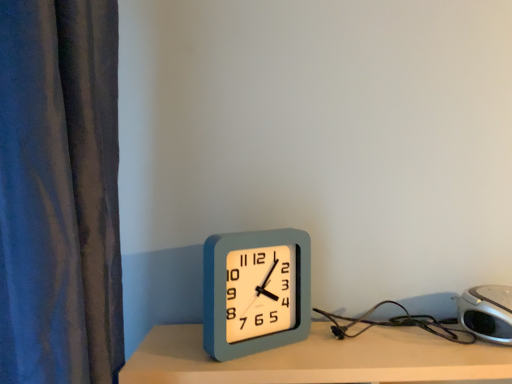
You are a GUI agent. You are given a task and a screenshot of the screen. Output one action in this format:
    pyautogui.click(x=<x>, y=<y>)
    Task: Click on the silver metallic alarm clock at lower right, arranged as the first alarm clock when viewed from the right
    The height and width of the screenshot is (384, 512).
    Given the screenshot: What is the action you would take?
    pyautogui.click(x=487, y=312)

What do you see at coordinates (487, 312) in the screenshot? I see `silver metallic alarm clock at lower right, arranged as the first alarm clock when viewed from the right` at bounding box center [487, 312].

How much space does silver metallic alarm clock at lower right, which is the second alarm clock in left-to-right order, occupy vertically?

silver metallic alarm clock at lower right, which is the second alarm clock in left-to-right order, is 3.45 inches in height.

Describe the element at coordinates (256, 291) in the screenshot. I see `light blue plastic clock at center, positioned as the second alarm clock in right-to-left order` at that location.

At what (x,y) coordinates should I click in order to perform the action: click on light blue plastic clock at center, positioned as the second alarm clock in right-to-left order. Please return your answer as a coordinate pair (x, y). The image size is (512, 384). Looking at the image, I should click on (256, 291).

This screenshot has height=384, width=512. Identify the location of silver metallic alarm clock at lower right, arranged as the first alarm clock when viewed from the right. (487, 312).

Considering the positions of objects silver metallic alarm clock at lower right, which is the second alarm clock in left-to-right order, and light blue plastic clock at center, positioned as the second alarm clock in right-to-left order, in the image provided, who is more to the left, silver metallic alarm clock at lower right, which is the second alarm clock in left-to-right order, or light blue plastic clock at center, positioned as the second alarm clock in right-to-left order,?

light blue plastic clock at center, positioned as the second alarm clock in right-to-left order.

Is silver metallic alarm clock at lower right, arranged as the first alarm clock when viewed from the right, positioned in front of light blue plastic clock at center, which ranks as the 1th alarm clock in left-to-right order?

Yes, it is in front of light blue plastic clock at center, which ranks as the 1th alarm clock in left-to-right order.

Considering the positions of point (476, 302) and point (250, 235), is point (476, 302) closer or farther from the camera than point (250, 235)?

Point (476, 302).

From the image's perspective, is silver metallic alarm clock at lower right, which is the second alarm clock in left-to-right order, beneath light blue plastic clock at center, which ranks as the 1th alarm clock in left-to-right order?

Correct, silver metallic alarm clock at lower right, which is the second alarm clock in left-to-right order, appears lower than light blue plastic clock at center, which ranks as the 1th alarm clock in left-to-right order, in the image.

From a real-world perspective, which object stands above the other?

From a 3D spatial view, light blue plastic clock at center, which ranks as the 1th alarm clock in left-to-right order, is above.

Does silver metallic alarm clock at lower right, arranged as the first alarm clock when viewed from the right, have a lesser width compared to light blue plastic clock at center, which ranks as the 1th alarm clock in left-to-right order?

Incorrect, the width of silver metallic alarm clock at lower right, arranged as the first alarm clock when viewed from the right, is not less than that of light blue plastic clock at center, which ranks as the 1th alarm clock in left-to-right order.

Who is taller, silver metallic alarm clock at lower right, which is the second alarm clock in left-to-right order, or light blue plastic clock at center, which ranks as the 1th alarm clock in left-to-right order?

With more height is light blue plastic clock at center, which ranks as the 1th alarm clock in left-to-right order.

Between silver metallic alarm clock at lower right, arranged as the first alarm clock when viewed from the right, and light blue plastic clock at center, which ranks as the 1th alarm clock in left-to-right order, which one has larger size?

silver metallic alarm clock at lower right, arranged as the first alarm clock when viewed from the right, is bigger.

Is light blue plastic clock at center, positioned as the second alarm clock in right-to-left order, completely or partially inside silver metallic alarm clock at lower right, which is the second alarm clock in left-to-right order?

Actually, light blue plastic clock at center, positioned as the second alarm clock in right-to-left order, is outside silver metallic alarm clock at lower right, which is the second alarm clock in left-to-right order.

Are silver metallic alarm clock at lower right, arranged as the first alarm clock when viewed from the right, and light blue plastic clock at center, which ranks as the 1th alarm clock in left-to-right order, making contact?

No, silver metallic alarm clock at lower right, arranged as the first alarm clock when viewed from the right, is not in contact with light blue plastic clock at center, which ranks as the 1th alarm clock in left-to-right order.

Could you tell me if silver metallic alarm clock at lower right, arranged as the first alarm clock when viewed from the right, is turned towards light blue plastic clock at center, positioned as the second alarm clock in right-to-left order?

No, silver metallic alarm clock at lower right, arranged as the first alarm clock when viewed from the right, is not facing towards light blue plastic clock at center, positioned as the second alarm clock in right-to-left order.

What's the angular difference between silver metallic alarm clock at lower right, which is the second alarm clock in left-to-right order, and light blue plastic clock at center, positioned as the second alarm clock in right-to-left order,'s facing directions?

The facing directions of silver metallic alarm clock at lower right, which is the second alarm clock in left-to-right order, and light blue plastic clock at center, positioned as the second alarm clock in right-to-left order, are 4.7 degrees apart.

At what (x,y) coordinates should I click in order to perform the action: click on alarm clock on the left of silver metallic alarm clock at lower right, which is the second alarm clock in left-to-right order. Please return your answer as a coordinate pair (x, y). The height and width of the screenshot is (384, 512). Looking at the image, I should click on point(256,291).

Consider the image. Would you say light blue plastic clock at center, which ranks as the 1th alarm clock in left-to-right order, is to the left or to the right of silver metallic alarm clock at lower right, arranged as the first alarm clock when viewed from the right, in the picture?

Based on their positions, light blue plastic clock at center, which ranks as the 1th alarm clock in left-to-right order, is located to the left of silver metallic alarm clock at lower right, arranged as the first alarm clock when viewed from the right.

Considering the positions of objects light blue plastic clock at center, positioned as the second alarm clock in right-to-left order, and silver metallic alarm clock at lower right, which is the second alarm clock in left-to-right order, in the image provided, who is in front, light blue plastic clock at center, positioned as the second alarm clock in right-to-left order, or silver metallic alarm clock at lower right, which is the second alarm clock in left-to-right order,?

silver metallic alarm clock at lower right, which is the second alarm clock in left-to-right order, is closer to the camera.

Considering the points (270, 328) and (494, 314), which point is in front, point (270, 328) or point (494, 314)?

The point (494, 314) is closer.

From the image's perspective, which one is positioned higher, light blue plastic clock at center, positioned as the second alarm clock in right-to-left order, or silver metallic alarm clock at lower right, arranged as the first alarm clock when viewed from the right?

light blue plastic clock at center, positioned as the second alarm clock in right-to-left order.

From a real-world perspective, who is located lower, light blue plastic clock at center, positioned as the second alarm clock in right-to-left order, or silver metallic alarm clock at lower right, which is the second alarm clock in left-to-right order?

silver metallic alarm clock at lower right, which is the second alarm clock in left-to-right order, is physically lower.

Looking at their sizes, would you say light blue plastic clock at center, which ranks as the 1th alarm clock in left-to-right order, is wider or thinner than silver metallic alarm clock at lower right, which is the second alarm clock in left-to-right order?

In the image, light blue plastic clock at center, which ranks as the 1th alarm clock in left-to-right order, appears to be more narrow than silver metallic alarm clock at lower right, which is the second alarm clock in left-to-right order.

Considering the sizes of objects light blue plastic clock at center, which ranks as the 1th alarm clock in left-to-right order, and silver metallic alarm clock at lower right, which is the second alarm clock in left-to-right order, in the image provided, who is taller, light blue plastic clock at center, which ranks as the 1th alarm clock in left-to-right order, or silver metallic alarm clock at lower right, which is the second alarm clock in left-to-right order,?

light blue plastic clock at center, which ranks as the 1th alarm clock in left-to-right order, is taller.

Considering the sizes of objects light blue plastic clock at center, positioned as the second alarm clock in right-to-left order, and silver metallic alarm clock at lower right, which is the second alarm clock in left-to-right order, in the image provided, who is bigger, light blue plastic clock at center, positioned as the second alarm clock in right-to-left order, or silver metallic alarm clock at lower right, which is the second alarm clock in left-to-right order,?

silver metallic alarm clock at lower right, which is the second alarm clock in left-to-right order, is bigger.

Is light blue plastic clock at center, positioned as the second alarm clock in right-to-left order, not inside silver metallic alarm clock at lower right, arranged as the first alarm clock when viewed from the right?

Yes, light blue plastic clock at center, positioned as the second alarm clock in right-to-left order, is not within silver metallic alarm clock at lower right, arranged as the first alarm clock when viewed from the right.

Is light blue plastic clock at center, positioned as the second alarm clock in right-to-left order, touching silver metallic alarm clock at lower right, arranged as the first alarm clock when viewed from the right?

No, light blue plastic clock at center, positioned as the second alarm clock in right-to-left order, is not next to silver metallic alarm clock at lower right, arranged as the first alarm clock when viewed from the right.

Is light blue plastic clock at center, positioned as the second alarm clock in right-to-left order, facing towards silver metallic alarm clock at lower right, which is the second alarm clock in left-to-right order?

No, light blue plastic clock at center, positioned as the second alarm clock in right-to-left order, is not oriented towards silver metallic alarm clock at lower right, which is the second alarm clock in left-to-right order.

Could you measure the distance between light blue plastic clock at center, positioned as the second alarm clock in right-to-left order, and silver metallic alarm clock at lower right, which is the second alarm clock in left-to-right order?

light blue plastic clock at center, positioned as the second alarm clock in right-to-left order, and silver metallic alarm clock at lower right, which is the second alarm clock in left-to-right order, are 16.99 inches apart from each other.

Locate an element on the screen. The image size is (512, 384). alarm clock on the right of the light blue plastic clock at center, positioned as the second alarm clock in right-to-left order is located at coordinates (487, 312).

You are a GUI agent. You are given a task and a screenshot of the screen. Output one action in this format:
    pyautogui.click(x=<x>, y=<y>)
    Task: Click on the alarm clock above the silver metallic alarm clock at lower right, which is the second alarm clock in left-to-right order (from the image's perspective)
    This screenshot has width=512, height=384.
    Given the screenshot: What is the action you would take?
    pyautogui.click(x=256, y=291)

Identify the location of alarm clock to the left of silver metallic alarm clock at lower right, which is the second alarm clock in left-to-right order. (256, 291).